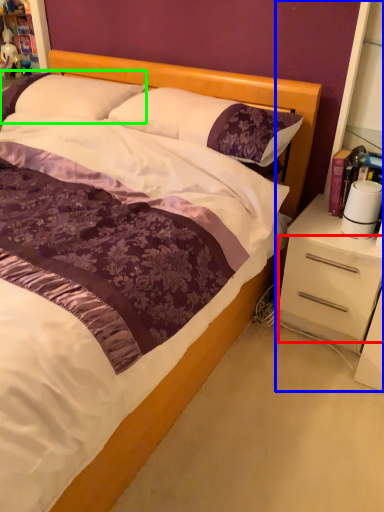
Question: Based on their relative distances, which object is farther from drawer (highlighted by a red box)? Choose from dresser (highlighted by a blue box) and pillow (highlighted by a green box).

Choices:
 (A) dresser
 (B) pillow

Answer: (B)